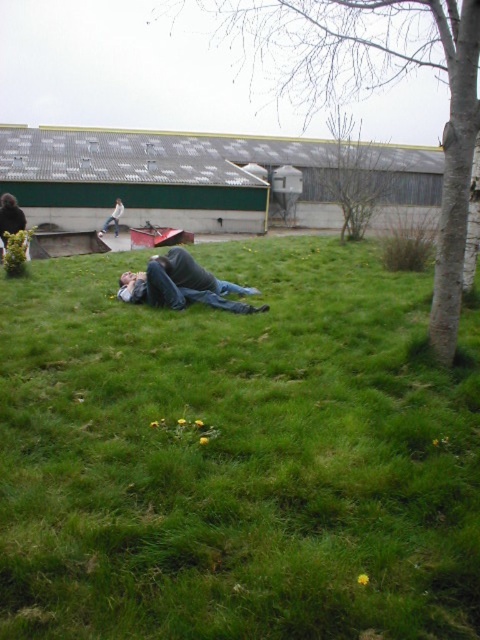
You are a drone operator who needs to fly a drone from the bark textured tree at lower right to the denim jeans at center. What is the minimum distance the drone must travel in meters?

The minimum distance the drone must travel is 17.32 meters between the bark textured tree at lower right and the denim jeans at center.

You are a photographer trying to capture a closeup of the green grass at center. However, the denim jeans at center are blocking your view. Can you move the jeans to the side to get a clear shot?

The green grass at center is positioned under denim jeans at center, so moving the denim jeans at center aside would allow you to see the green grass at center clearly.

You are a photographer trying to capture a shot of the green grass at center and the bare branches at upper center. Which object should you adjust your camera to focus on first if you want to ensure both are in frame without moving the camera?

The green grass at center is positioned on the left side of the bare branches at upper center, so you should focus on the bare branches at upper center first to ensure both are in frame without moving the camera.